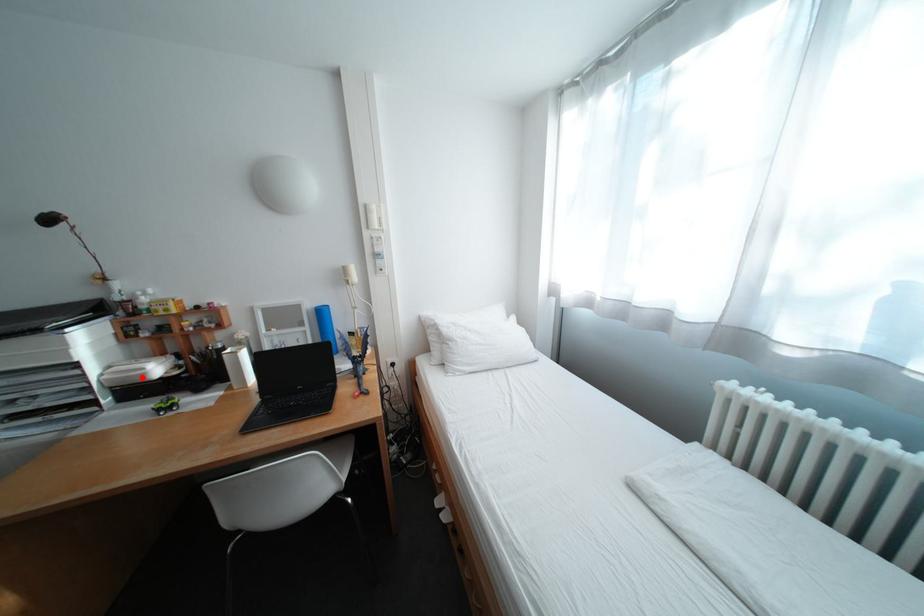
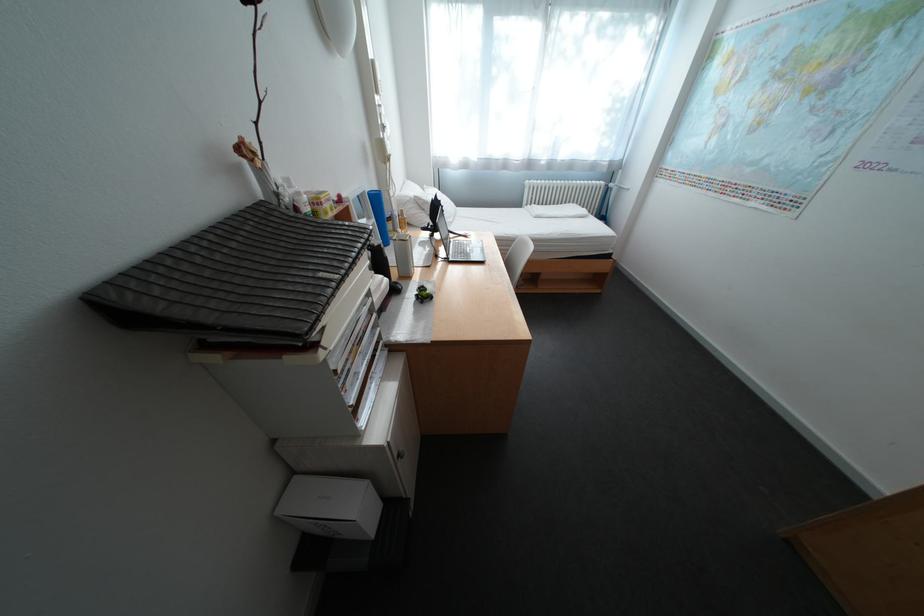
Question: I am providing you with two images of the same scene from different viewpoints. A red point is shown in image1. For the corresponding object point in image2, is it positioned nearer or farther from the camera?

Choices:
 (A) Nearer
 (B) Farther

Answer: (A)